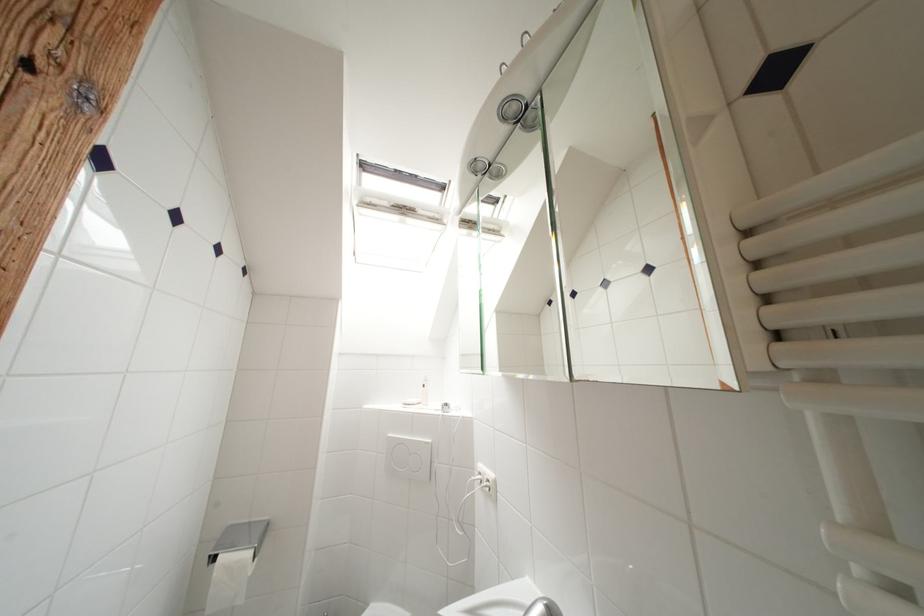
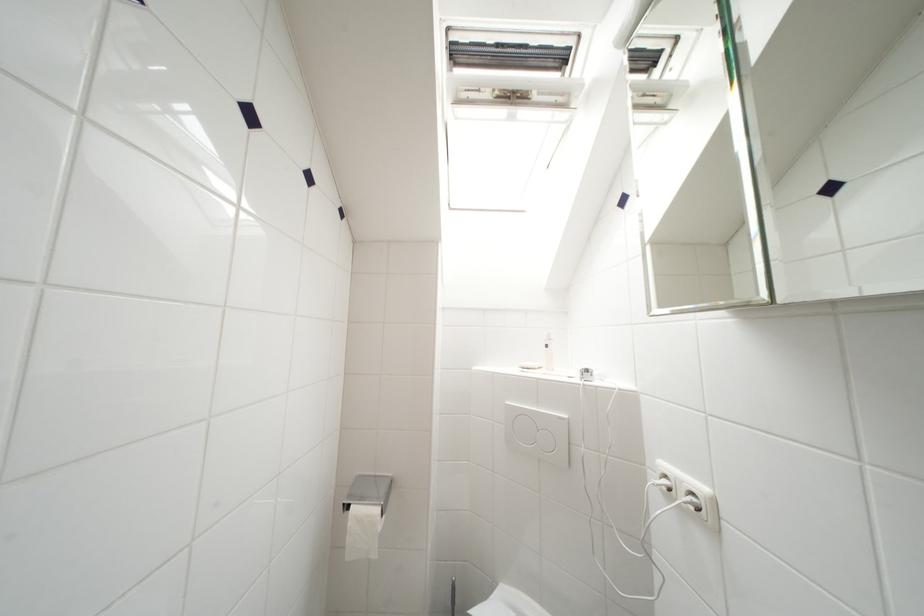
The point at [432,446] is marked in the first image. Where is the corresponding point in the second image?

(565, 421)